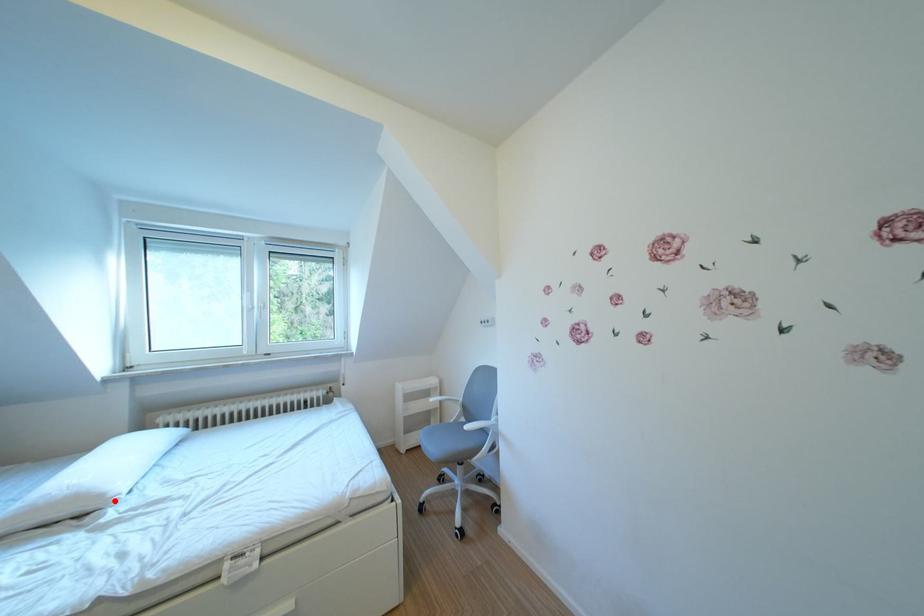
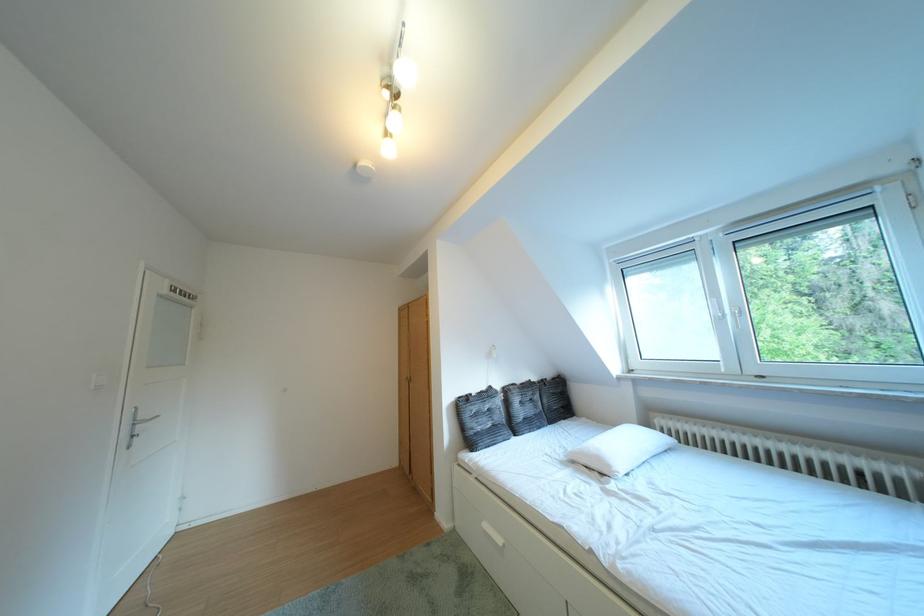
The point at the highlighted location is marked in the first image. Where is the corresponding point in the second image?

(623, 471)